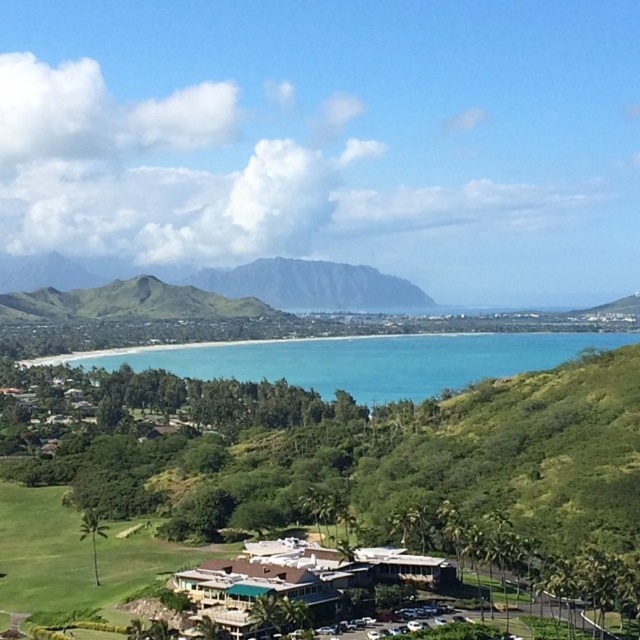
Is green grassy mountain at center taller than white textured building at center?

Yes, green grassy mountain at center is taller than white textured building at center.

Is green grassy mountain at center bigger than white textured building at center?

Yes.

This screenshot has height=640, width=640. What do you see at coordinates (305, 284) in the screenshot?
I see `green grassy mountain at center` at bounding box center [305, 284].

Where is `green grassy mountain at center`? The height and width of the screenshot is (640, 640). green grassy mountain at center is located at coordinates (305, 284).

Is green grassy mountain at center in front of green grassy hill at center?

No.

Who is more distant from viewer, (131,272) or (168,304)?

The point (131,272) is more distant.

You are a GUI agent. You are given a task and a screenshot of the screen. Output one action in this format:
    pyautogui.click(x=<x>, y=<y>)
    Task: Click on the green grassy mountain at center
    This screenshot has width=640, height=640.
    Given the screenshot: What is the action you would take?
    pyautogui.click(x=305, y=284)

Does white textured building at center lie behind green grassy hill at center?

No.

In the scene shown: Can you confirm if white textured building at center is positioned above green grassy hill at center?

No, white textured building at center is not above green grassy hill at center.

Which is in front, point (308, 588) or point (157, 300)?

Point (308, 588) is more forward.

Locate an element on the screen. white textured building at center is located at coordinates (300, 577).